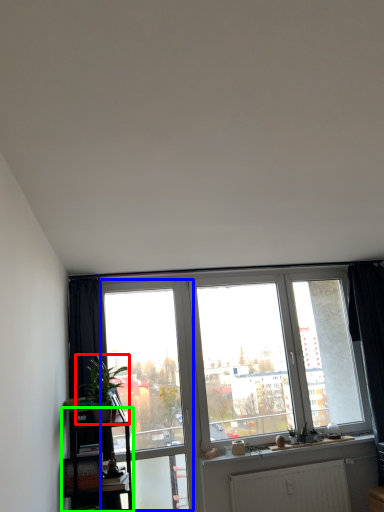
Question: Which object is positioned farthest from houseplant (highlighted by a red box)? Select from screen door (highlighted by a blue box) and shelf (highlighted by a green box).

Choices:
 (A) screen door
 (B) shelf

Answer: (A)